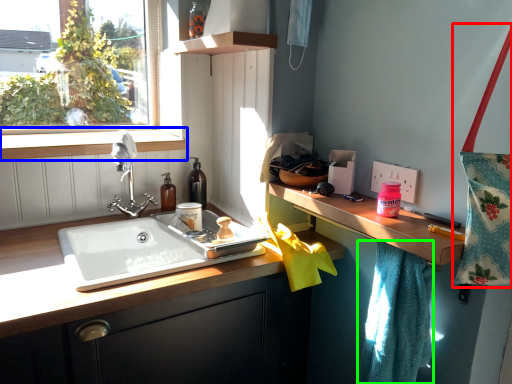
Question: Considering the real-world distances, which object is farthest from tote bag (highlighted by a red box)? window sill (highlighted by a blue box) or bath towel (highlighted by a green box)?

Choices:
 (A) window sill
 (B) bath towel

Answer: (A)